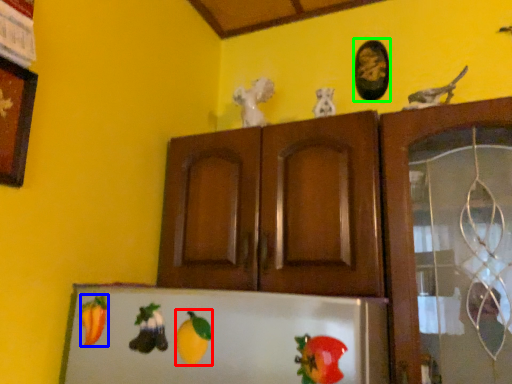
Question: Considering the real-world distances, which object is closest to fruit (highlighted by a red box)? fruit (highlighted by a blue box) or picture frame (highlighted by a green box).

Choices:
 (A) fruit
 (B) picture frame

Answer: (A)